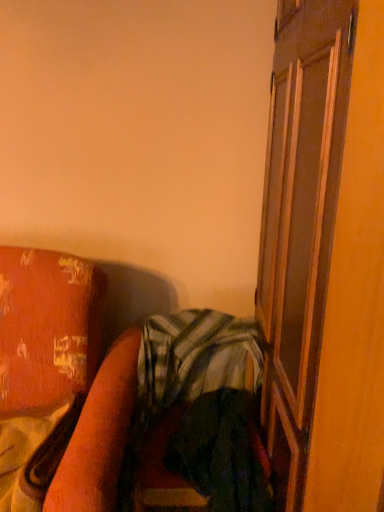
Question: From a real-world perspective, is brown wooden screen door at right on top of wooden bed frame at lower left?

Choices:
 (A) no
 (B) yes

Answer: (B)

Question: Does brown wooden screen door at right have a lesser height compared to wooden bed frame at lower left?

Choices:
 (A) no
 (B) yes

Answer: (A)

Question: Considering the relative sizes of brown wooden screen door at right and wooden bed frame at lower left in the image provided, is brown wooden screen door at right smaller than wooden bed frame at lower left?

Choices:
 (A) no
 (B) yes

Answer: (A)

Question: Considering the relative sizes of brown wooden screen door at right and wooden bed frame at lower left in the image provided, is brown wooden screen door at right wider than wooden bed frame at lower left?

Choices:
 (A) yes
 (B) no

Answer: (B)

Question: Is brown wooden screen door at right aimed at wooden bed frame at lower left?

Choices:
 (A) no
 (B) yes

Answer: (B)

Question: Is brown wooden screen door at right to the left or to the right of wooden bed frame at lower left in the image?

Choices:
 (A) left
 (B) right

Answer: (B)

Question: Is brown wooden screen door at right in front of or behind wooden bed frame at lower left in the image?

Choices:
 (A) front
 (B) behind

Answer: (A)

Question: From a real-world perspective, is brown wooden screen door at right above or below wooden bed frame at lower left?

Choices:
 (A) below
 (B) above

Answer: (B)

Question: Looking at their shapes, would you say brown wooden screen door at right is wider or thinner than wooden bed frame at lower left?

Choices:
 (A) wide
 (B) thin

Answer: (B)

Question: From a real-world perspective, is green striped fabric at center above or below brown wooden screen door at right?

Choices:
 (A) above
 (B) below

Answer: (B)

Question: Is green striped fabric at center in front of or behind brown wooden screen door at right in the image?

Choices:
 (A) front
 (B) behind

Answer: (B)

Question: In terms of height, does green striped fabric at center look taller or shorter compared to brown wooden screen door at right?

Choices:
 (A) short
 (B) tall

Answer: (A)

Question: From the image's perspective, relative to brown wooden screen door at right, is green striped fabric at center above or below?

Choices:
 (A) above
 (B) below

Answer: (B)

Question: From a real-world perspective, is wooden bed frame at lower left physically located above or below brown wooden screen door at right?

Choices:
 (A) above
 (B) below

Answer: (B)

Question: From the image's perspective, is wooden bed frame at lower left located above or below brown wooden screen door at right?

Choices:
 (A) below
 (B) above

Answer: (A)